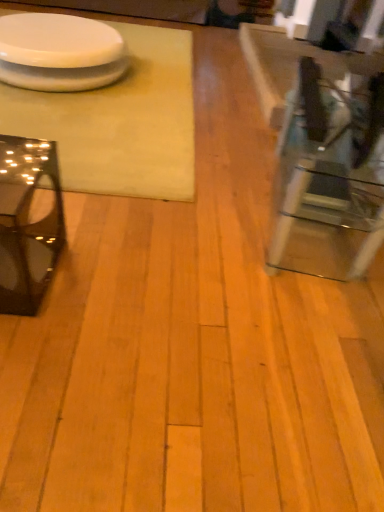
Question: Considering the positions of white matte table at upper left, which ranks as the third table in right-to-left order, and white glossy platter at upper left in the image, is white matte table at upper left, which ranks as the third table in right-to-left order, taller or shorter than white glossy platter at upper left?

Choices:
 (A) tall
 (B) short

Answer: (B)

Question: Considering their positions, is white matte table at upper left, which ranks as the third table in right-to-left order, located in front of or behind white glossy platter at upper left?

Choices:
 (A) behind
 (B) front

Answer: (B)

Question: Estimate the real-world distances between objects in this image. Which object is closer to the white glossy platter at upper left?

Choices:
 (A) glossy black glass table at left, the second table from the left
 (B) clear glass table at right, which is the third table from left to right
 (C) white matte table at upper left, acting as the first table starting from the left

Answer: (C)

Question: Based on their relative distances, which object is farther from the white glossy platter at upper left?

Choices:
 (A) clear glass table at right, the first table in the right-to-left sequence
 (B) glossy black glass table at left, which is the second table in right-to-left order
 (C) white matte table at upper left, acting as the first table starting from the left

Answer: (A)